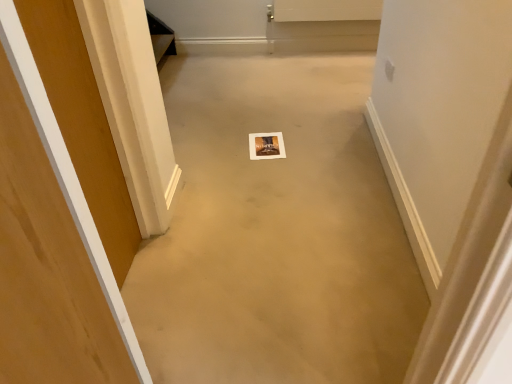
In order to click on beige carpet at center in this screenshot , I will do `click(276, 233)`.

The image size is (512, 384). What do you see at coordinates (276, 233) in the screenshot? I see `beige carpet at center` at bounding box center [276, 233].

Where is `wooden door at left`? wooden door at left is located at coordinates (46, 263).

In order to face wooden door at left, should I rotate leftwards or rightwards?

You should look left and rotate roughly 20.434 degrees.

The height and width of the screenshot is (384, 512). What do you see at coordinates (46, 263) in the screenshot? I see `wooden door at left` at bounding box center [46, 263].

Measure the distance between point (85, 312) and camera.

Point (85, 312) and camera are 77.30 centimeters apart.

At what (x,y) coordinates should I click in order to perform the action: click on beige carpet at center. Please return your answer as a coordinate pair (x, y). This screenshot has width=512, height=384. Looking at the image, I should click on (276, 233).

Consider the image. Considering the relative positions of beige carpet at center and wooden door at left in the image provided, is beige carpet at center to the left or to the right of wooden door at left?

Based on their positions, beige carpet at center is located to the right of wooden door at left.

Which object is further away from the camera, beige carpet at center or wooden door at left?

beige carpet at center is further away from the camera.

Which is behind, point (209, 230) or point (21, 372)?

The point (209, 230) is behind.

From the image's perspective, between beige carpet at center and wooden door at left, who is located below?

wooden door at left, from the image's perspective.

From a real-world perspective, between beige carpet at center and wooden door at left, who is vertically lower?

In real-world perspective, beige carpet at center is lower.

Which object is thinner, beige carpet at center or wooden door at left?

With smaller width is wooden door at left.

Which of these two, beige carpet at center or wooden door at left, stands shorter?

With less height is beige carpet at center.

Can you confirm if beige carpet at center is smaller than wooden door at left?

Actually, beige carpet at center might be larger than wooden door at left.

Would you say beige carpet at center is outside wooden door at left?

Indeed, beige carpet at center is completely outside wooden door at left.

Is beige carpet at center in contact with wooden door at left?

beige carpet at center and wooden door at left are not in contact.

Is wooden door at left at the back of beige carpet at center?

beige carpet at center does not have its back to wooden door at left.

How different are the orientations of beige carpet at center and wooden door at left in degrees?

The angle between the facing direction of beige carpet at center and the facing direction of wooden door at left is 88.7 degrees.

You are a GUI agent. You are given a task and a screenshot of the screen. Output one action in this format:
    pyautogui.click(x=<x>, y=<y>)
    Task: Click on the concrete above the wooden door at left (from the image's perspective)
    
    Given the screenshot: What is the action you would take?
    pyautogui.click(x=276, y=233)

Is wooden door at left at the left side of beige carpet at center?

Indeed, wooden door at left is positioned on the left side of beige carpet at center.

Considering their positions, is wooden door at left located in front of or behind beige carpet at center?

In the image, wooden door at left appears in front of beige carpet at center.

Considering the positions of point (21, 225) and point (195, 371), is point (21, 225) closer or farther from the camera than point (195, 371)?

Point (21, 225) is closer to the camera than point (195, 371).

From the image's perspective, between wooden door at left and beige carpet at center, who is located below?

From the image's view, wooden door at left is below.

From a real-world perspective, which is physically below, wooden door at left or beige carpet at center?

beige carpet at center, from a real-world perspective.

Is wooden door at left thinner than beige carpet at center?

Indeed, wooden door at left has a lesser width compared to beige carpet at center.

Considering the sizes of wooden door at left and beige carpet at center in the image, is wooden door at left taller or shorter than beige carpet at center?

In the image, wooden door at left appears to be taller than beige carpet at center.

Can you confirm if wooden door at left is bigger than beige carpet at center?

No.

Can beige carpet at center be found inside wooden door at left?

No, beige carpet at center is not a part of wooden door at left.

Is wooden door at left touching beige carpet at center?

wooden door at left is not next to beige carpet at center, and they're not touching.

Does wooden door at left turn towards beige carpet at center?

No, wooden door at left is not turned towards beige carpet at center.

The height and width of the screenshot is (384, 512). Identify the location of door above the beige carpet at center (from a real-world perspective). (46, 263).

At what (x,y) coordinates should I click in order to perform the action: click on door below the beige carpet at center (from the image's perspective). Please return your answer as a coordinate pair (x, y). Image resolution: width=512 pixels, height=384 pixels. Looking at the image, I should click on (46, 263).

Identify the location of door positioned vertically above the beige carpet at center (from a real-world perspective). This screenshot has height=384, width=512. (46, 263).